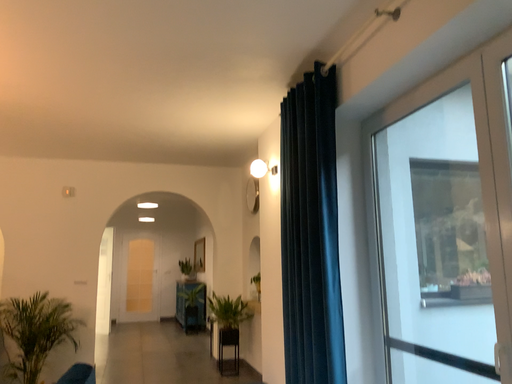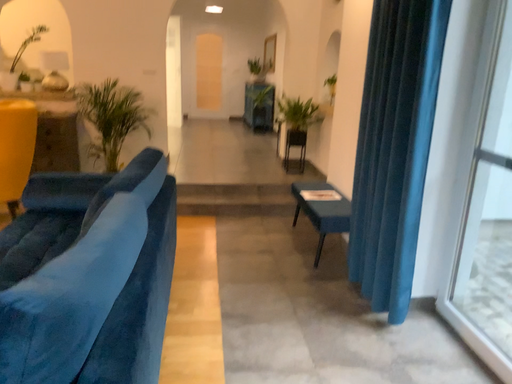
Question: Which way did the camera rotate in the video?

Choices:
 (A) rotated right
 (B) rotated left

Answer: (B)